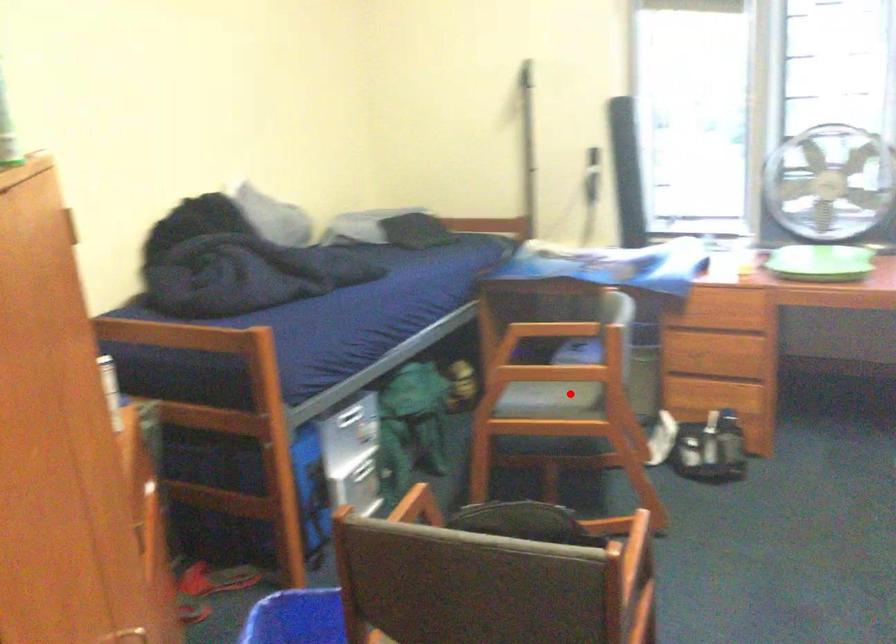
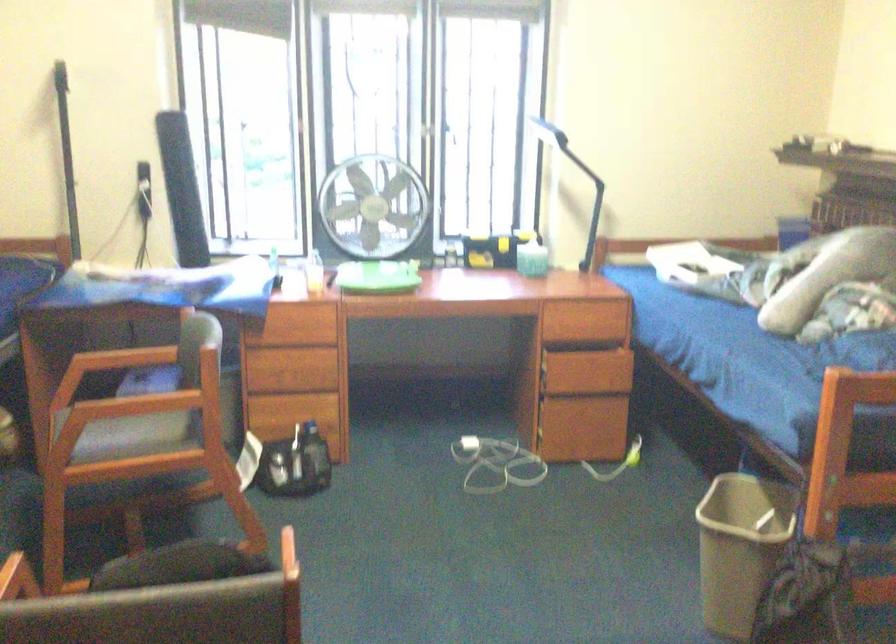
Find the pixel in the second image that matches the highlighted location in the first image.

(156, 427)